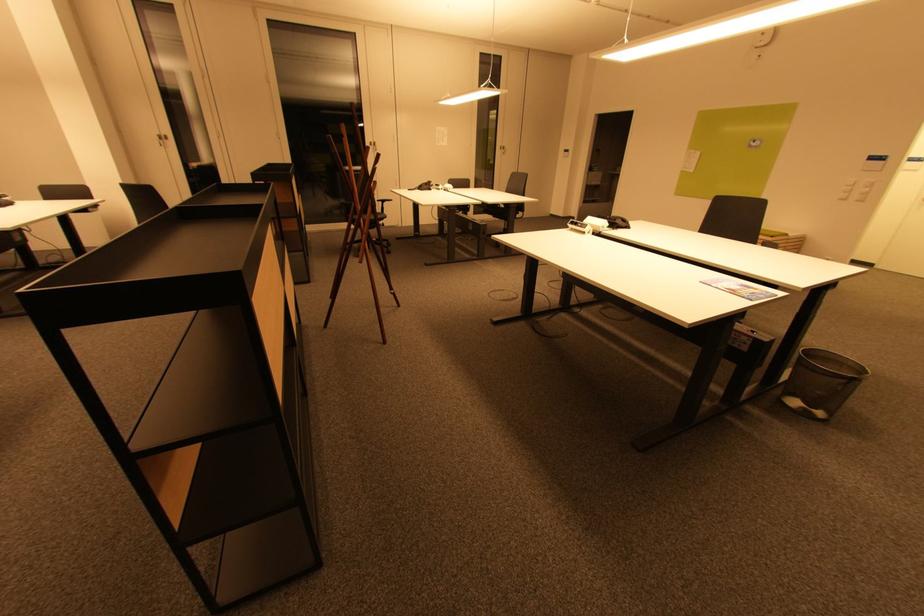
Where would you lift the white telephone handset? Please return your answer as a coordinate pair (x, y).

(578, 227)